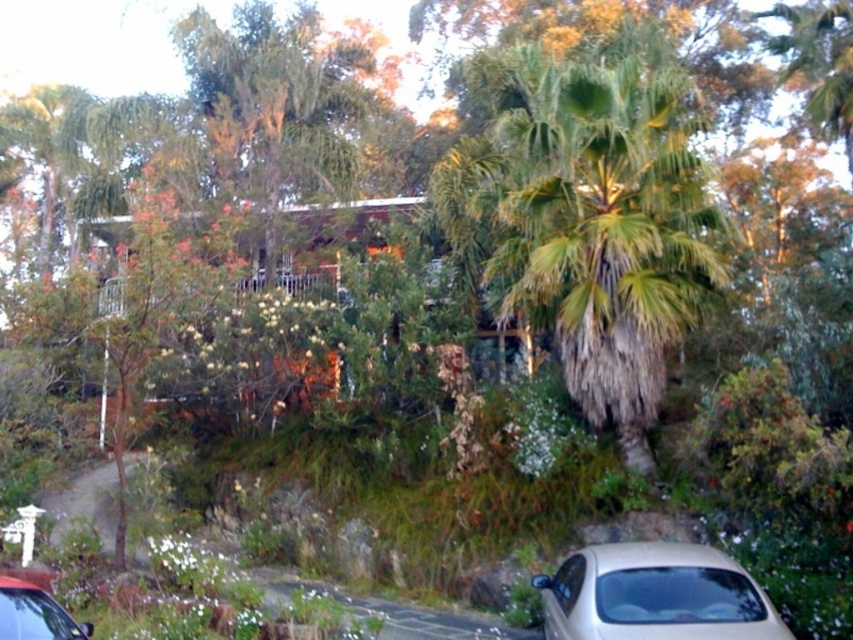
Is beige matte car at lower right behind metallic silver car at lower left?

Yes.

Does beige matte car at lower right have a larger size compared to metallic silver car at lower left?

Yes.

Is point (697, 548) farther from camera compared to point (16, 582)?

Yes, it is.

This screenshot has height=640, width=853. Find the location of `beige matte car at lower right`. beige matte car at lower right is located at coordinates (654, 595).